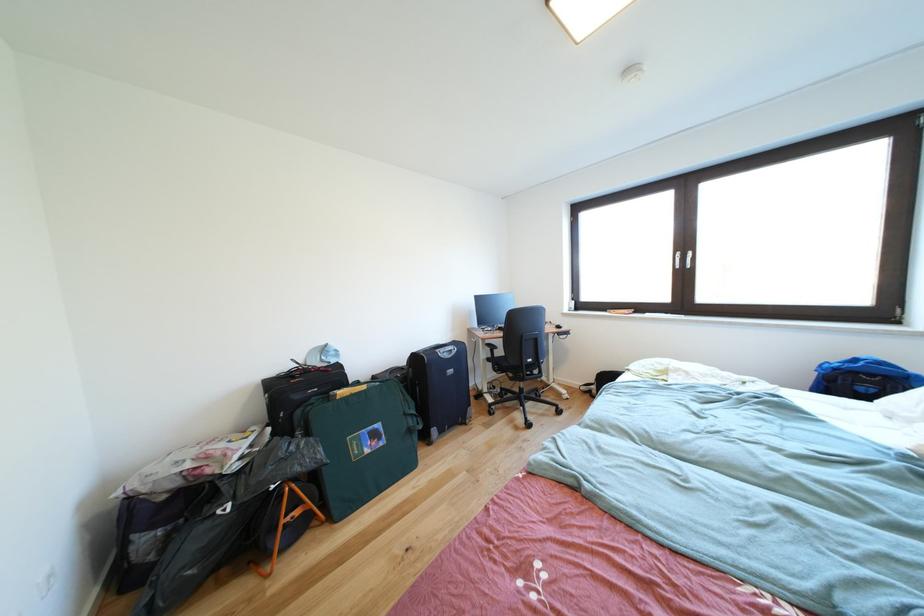
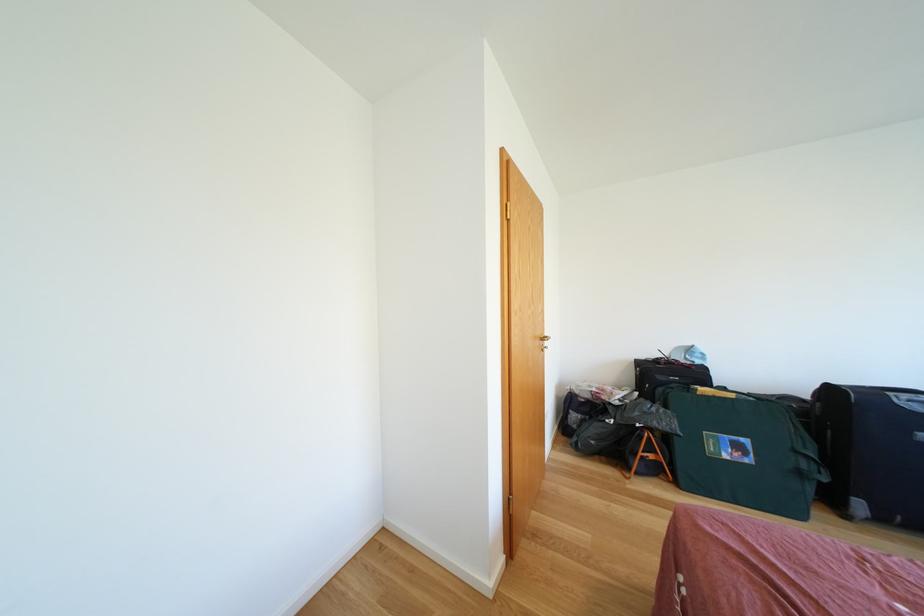
In the second image, find the point that corresponds to point 372,392 in the first image.

(739, 400)